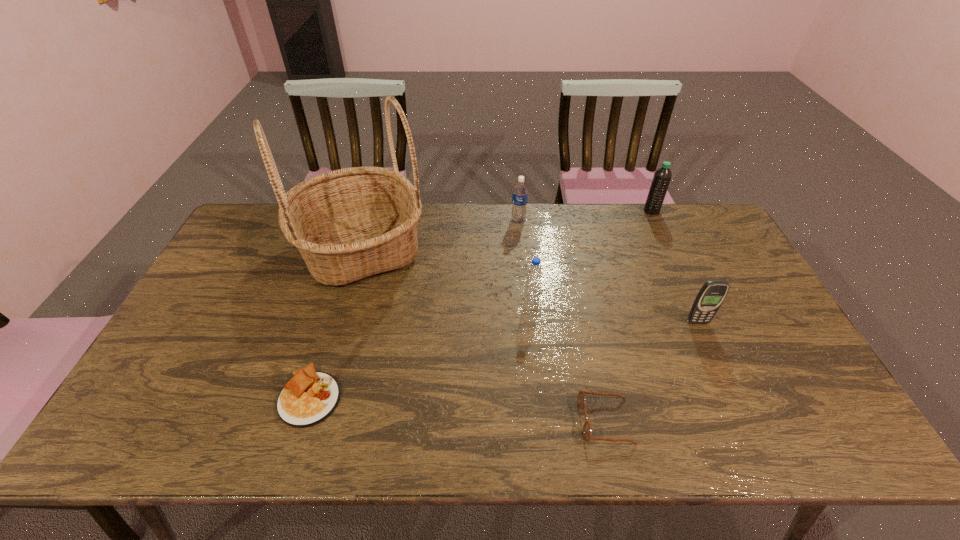
Identify the location of the tallest object. click(348, 224).

At what (x,y) coordinates should I click in order to perform the action: click on the rightmost water bottle. Please return your answer as a coordinate pair (x, y). Looking at the image, I should click on (662, 177).

Find the location of a particular element. This screenshot has height=540, width=960. the second nearest water bottle is located at coordinates (520, 190).

Locate an element on the screen. Image resolution: width=960 pixels, height=540 pixels. the nearest water bottle is located at coordinates (534, 273).

This screenshot has width=960, height=540. Identify the location of the fifth farthest object. (709, 299).

Find the location of a particular element. The image size is (960, 540). the third object from right to left is located at coordinates (581, 399).

At what (x,y) coordinates should I click in order to perform the action: click on spectacles. Please return your answer as a coordinate pair (x, y). Looking at the image, I should click on (581, 399).

At what (x,y) coordinates should I click in order to perform the action: click on the shortest object. Please return your answer as a coordinate pair (x, y). Looking at the image, I should click on (310, 397).

Locate an element on the screen. The height and width of the screenshot is (540, 960). vacant space located 0.060m on the right of the basket is located at coordinates (446, 249).

Locate an element on the screen. This screenshot has width=960, height=540. free space located on the left of the farthest water bottle is located at coordinates (572, 211).